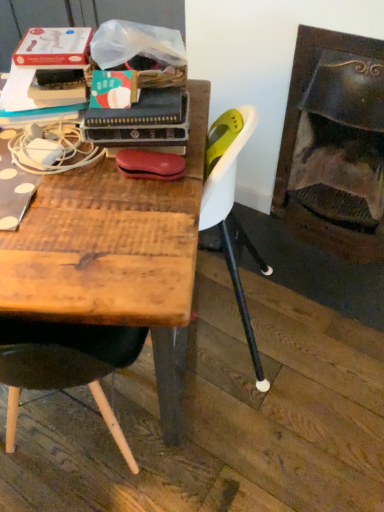
Question: In terms of height, does dark brown wood fireplace at right look taller or shorter compared to wooden table at center?

Choices:
 (A) short
 (B) tall

Answer: (B)

Question: Is dark brown wood fireplace at right spatially inside wooden table at center, or outside of it?

Choices:
 (A) outside
 (B) inside

Answer: (A)

Question: Looking at their shapes, would you say dark brown wood fireplace at right is wider or thinner than wooden table at center?

Choices:
 (A) wide
 (B) thin

Answer: (B)

Question: Looking at their shapes, would you say wooden table at center is wider or thinner than dark brown wood fireplace at right?

Choices:
 (A) wide
 (B) thin

Answer: (A)

Question: Is wooden table at center taller or shorter than dark brown wood fireplace at right?

Choices:
 (A) short
 (B) tall

Answer: (A)

Question: Do you think wooden table at center is within dark brown wood fireplace at right, or outside of it?

Choices:
 (A) inside
 (B) outside

Answer: (B)

Question: Considering the positions of wooden table at center and dark brown wood fireplace at right in the image, is wooden table at center bigger or smaller than dark brown wood fireplace at right?

Choices:
 (A) small
 (B) big

Answer: (B)